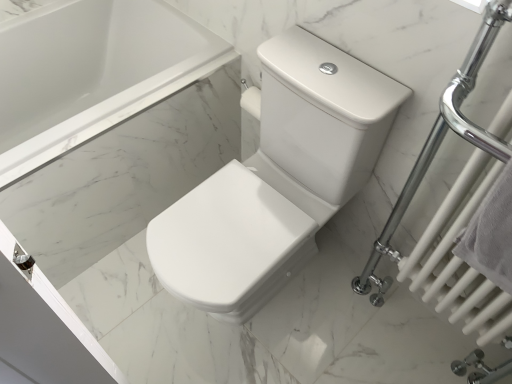
Question: Is white glossy toilet at center next to white cotton towel at right and touching it?

Choices:
 (A) no
 (B) yes

Answer: (A)

Question: Can you confirm if white glossy toilet at center is positioned to the right of white cotton towel at right?

Choices:
 (A) no
 (B) yes

Answer: (A)

Question: Considering the relative sizes of white glossy toilet at center and white cotton towel at right in the image provided, is white glossy toilet at center thinner than white cotton towel at right?

Choices:
 (A) no
 (B) yes

Answer: (A)

Question: Considering the relative sizes of white glossy toilet at center and white cotton towel at right in the image provided, is white glossy toilet at center bigger than white cotton towel at right?

Choices:
 (A) no
 (B) yes

Answer: (B)

Question: Is white glossy toilet at center positioned beyond the bounds of white cotton towel at right?

Choices:
 (A) yes
 (B) no

Answer: (A)

Question: In the image, is white glossy toilet at center on the left side or the right side of white marble bathtub at upper left?

Choices:
 (A) right
 (B) left

Answer: (A)

Question: From a real-world perspective, is white glossy toilet at center positioned above or below white marble bathtub at upper left?

Choices:
 (A) above
 (B) below

Answer: (A)

Question: Do you think white glossy toilet at center is within white marble bathtub at upper left, or outside of it?

Choices:
 (A) outside
 (B) inside

Answer: (A)

Question: Is white glossy toilet at center wider or thinner than white marble bathtub at upper left?

Choices:
 (A) thin
 (B) wide

Answer: (B)

Question: Would you say white glossy toilet at center is inside or outside white glossy towel rack at right?

Choices:
 (A) inside
 (B) outside

Answer: (B)

Question: From the image's perspective, relative to white glossy towel rack at right, is white glossy toilet at center above or below?

Choices:
 (A) above
 (B) below

Answer: (A)

Question: In terms of width, does white glossy toilet at center look wider or thinner when compared to white glossy towel rack at right?

Choices:
 (A) thin
 (B) wide

Answer: (B)

Question: From a real-world perspective, relative to white glossy towel rack at right, is white glossy toilet at center vertically above or below?

Choices:
 (A) below
 (B) above

Answer: (A)

Question: Based on their positions, is white glossy towel rack at right located to the left or right of white cotton towel at right?

Choices:
 (A) right
 (B) left

Answer: (A)

Question: Is white glossy towel rack at right taller or shorter than white cotton towel at right?

Choices:
 (A) tall
 (B) short

Answer: (A)